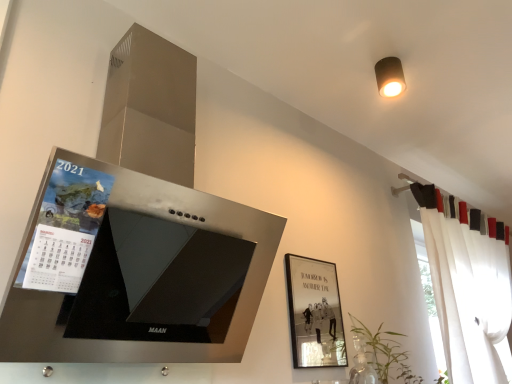
Question: Is matte black picture frame at center-right taller or shorter than matte brown cylindrical light fixture at upper right?

Choices:
 (A) short
 (B) tall

Answer: (B)

Question: From a real-world perspective, is matte black picture frame at center-right above or below matte brown cylindrical light fixture at upper right?

Choices:
 (A) above
 (B) below

Answer: (B)

Question: Which of these objects is positioned closest to the green leafy plant at lower right?

Choices:
 (A) matte brown cylindrical light fixture at upper right
 (B) white sheer curtain at right
 (C) matte paper calendar at left
 (D) clear glass vase at lower right
 (E) matte black picture frame at center-right

Answer: (D)

Question: Which object is positioned closest to the matte paper calendar at left?

Choices:
 (A) matte black picture frame at center-right
 (B) white sheer curtain at right
 (C) clear glass vase at lower right
 (D) matte brown cylindrical light fixture at upper right
 (E) green leafy plant at lower right

Answer: (A)